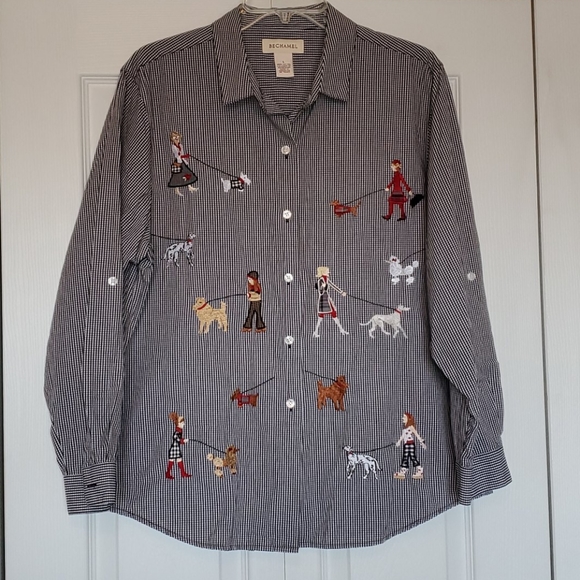
At what (x,y) coordinates should I click in order to perform the action: click on artwork middle lower left. Please return your answer as a coordinate pair (x, y). The width and height of the screenshot is (580, 580). Looking at the image, I should click on (246, 287).